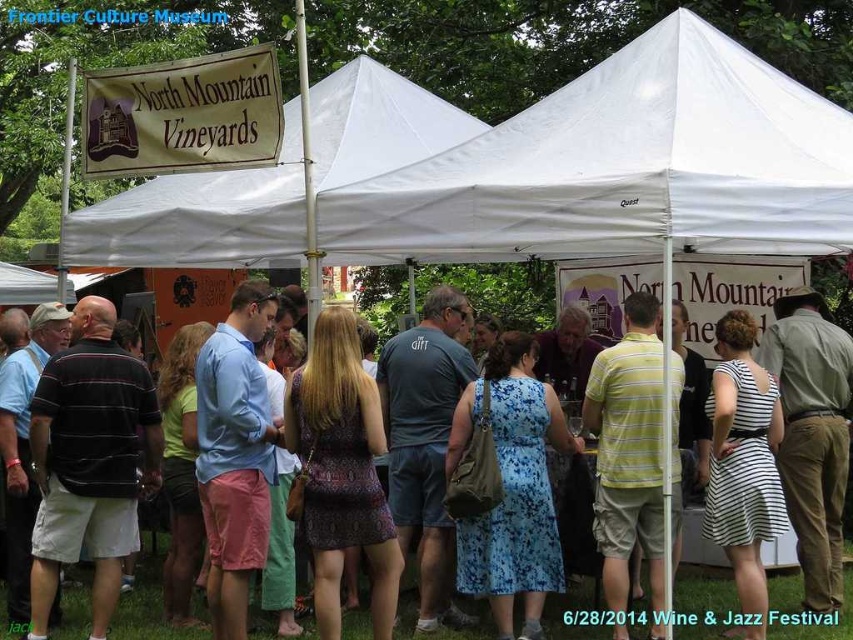
You are a photographer standing at the edge of the grassy area at the North Mountain Vineyards Wine and Jazz Festival. You want to capture a photo of both the white fabric canopy at center and the floral dress at center in the same frame. Given that your camera has a maximum focus range of 3 meters, will you be able to include both subjects in a single focused shot?

The distance between the white fabric canopy at center and the floral dress at center is 3.64 meters. Since your camera can only focus up to 3 meters, you won

You are standing at the entrance of the Frontier Culture Museum and want to locate the white fabric canopy at center. Which direction should you face to see it?

The white fabric canopy at center is located at coordinates 0.263 along the x axis and 0.730 along the y axis, so you should face towards the center area of the image to see it.